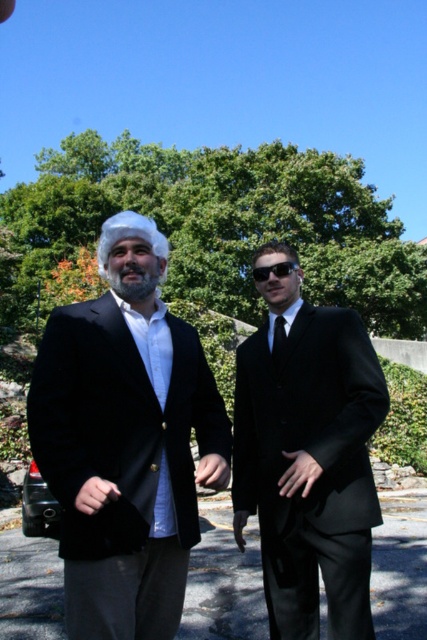
Can you confirm if graywoollybeard at center is positioned above black silk tie at center?

Yes.

How far apart are graywoollybeard at center and black silk tie at center?

A distance of 71.77 centimeters exists between graywoollybeard at center and black silk tie at center.

The width and height of the screenshot is (427, 640). Find the location of `graywoollybeard at center`. graywoollybeard at center is located at coordinates (134, 282).

Between black velvet suit at right and black plastic sunglasses at center, which one appears on the left side from the viewer's perspective?

From the viewer's perspective, black plastic sunglasses at center appears more on the left side.

Locate an element on the screen. black velvet suit at right is located at coordinates [309, 461].

Find the location of `black velvet suit at right`. black velvet suit at right is located at coordinates (309, 461).

Which is behind, point (96, 426) or point (278, 269)?

The point (278, 269) is behind.

Who is higher up, black velvet suit at left or black plastic sunglasses at center?

black plastic sunglasses at center

Where is `black velvet suit at left`? This screenshot has width=427, height=640. black velvet suit at left is located at coordinates (122, 465).

This screenshot has width=427, height=640. In order to click on black velvet suit at left in this screenshot , I will do `click(122, 465)`.